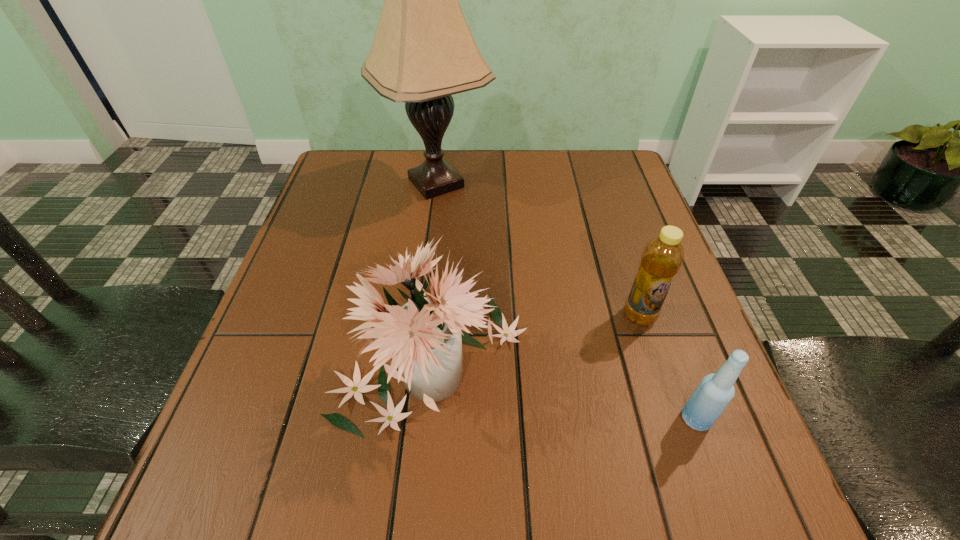
Identify the location of vacant point located between the lamp and the third shortest object. (434, 272).

Find the location of a particular element. vacant area between the bouquet and the third tallest object is located at coordinates (536, 338).

Find the location of a particular element. The height and width of the screenshot is (540, 960). blank region between the farthest object and the taller bottle is located at coordinates (538, 249).

Locate an element on the screen. free spot between the farther bottle and the third shortest object is located at coordinates (536, 338).

Locate an element on the screen. free space between the nearer bottle and the third shortest object is located at coordinates (564, 389).

Where is `vacant area that lies between the taller bottle and the farthest object`? This screenshot has width=960, height=540. vacant area that lies between the taller bottle and the farthest object is located at coordinates (538, 249).

Locate an element on the screen. This screenshot has height=540, width=960. unoccupied area between the farthest object and the taller bottle is located at coordinates (538, 249).

At what (x,y) coordinates should I click in order to perform the action: click on free space between the farther bottle and the farthest object. Please return your answer as a coordinate pair (x, y). This screenshot has width=960, height=540. Looking at the image, I should click on (538, 249).

Where is `free area in between the third shortest object and the taller bottle`? The width and height of the screenshot is (960, 540). free area in between the third shortest object and the taller bottle is located at coordinates (536, 338).

Find the location of `vacant space that's between the taller bottle and the second tallest object`. vacant space that's between the taller bottle and the second tallest object is located at coordinates (536, 338).